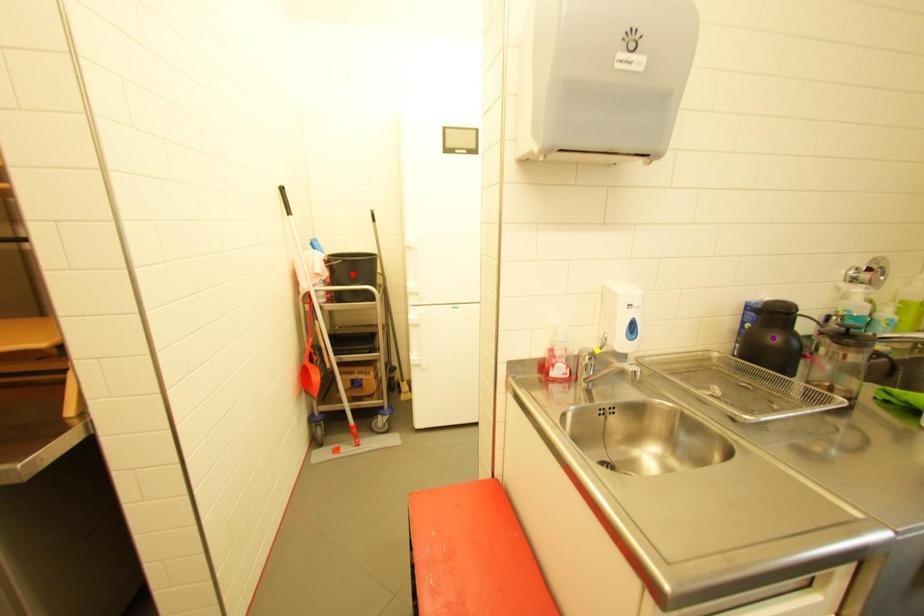
Order these from nearest to farthest:
purple point
red point
yellow point

red point
purple point
yellow point